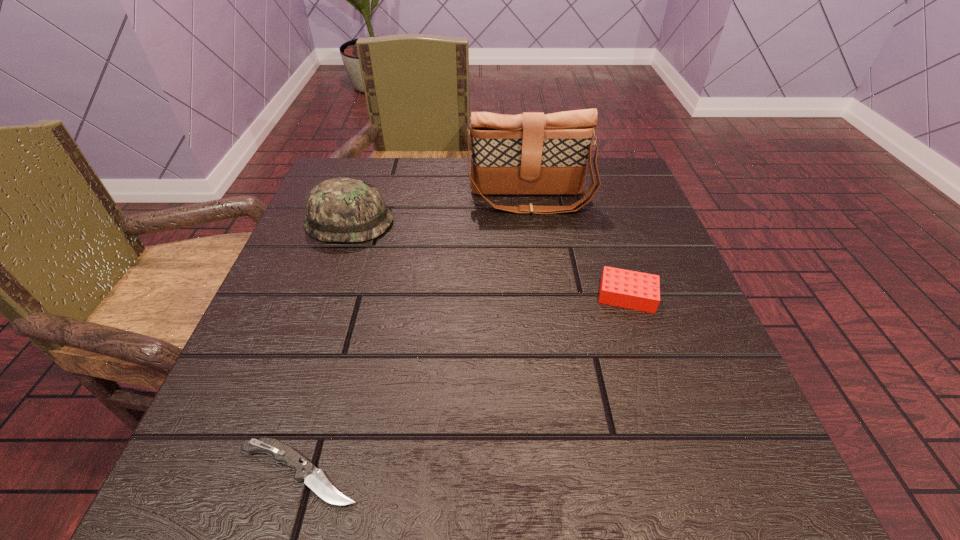
The height and width of the screenshot is (540, 960). I want to click on empty location between the second shortest object and the nearest object, so click(463, 384).

The image size is (960, 540). I want to click on vacant region between the headwear and the shortest object, so click(324, 347).

Where is `blank region between the headwear and the shortest object`? This screenshot has width=960, height=540. blank region between the headwear and the shortest object is located at coordinates (324, 347).

Where is `free spot between the Lego and the tallest object`? The width and height of the screenshot is (960, 540). free spot between the Lego and the tallest object is located at coordinates (579, 247).

Image resolution: width=960 pixels, height=540 pixels. I want to click on free point between the shoulder bag and the headwear, so click(440, 211).

Locate an element on the screen. The height and width of the screenshot is (540, 960). blank region between the nearest object and the headwear is located at coordinates (324, 347).

Where is `object that is the second closest to the nearest object`? object that is the second closest to the nearest object is located at coordinates (635, 290).

Choose which object is the second nearest neighbor to the third tallest object. Please provide its 2D coordinates. Your answer should be formatted as a tuple, i.e. [(x, y)], where the tuple contains the x and y coordinates of a point satisfying the conditions above.

[(339, 209)]